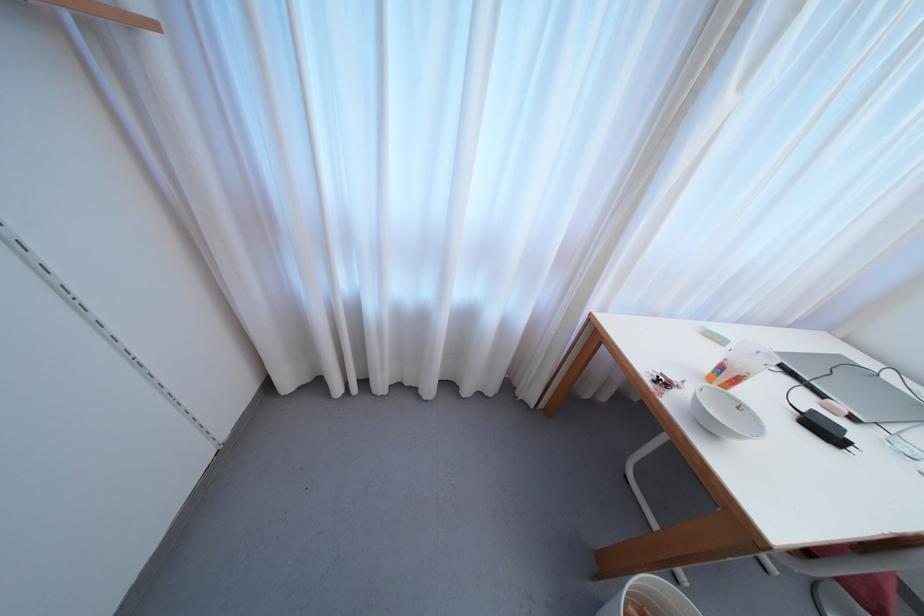
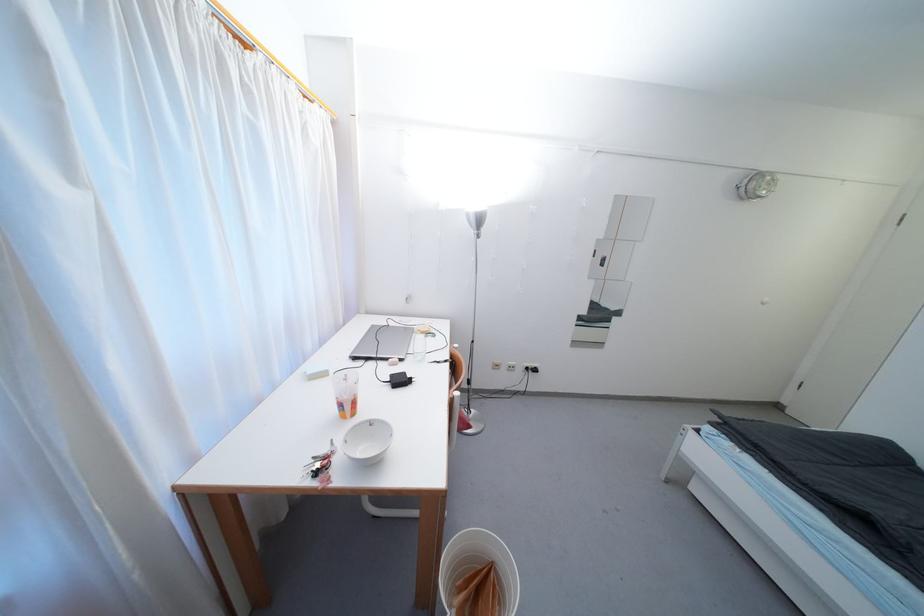
Locate, in the second image, the point that corresponds to point 762,355 in the first image.

(349, 378)